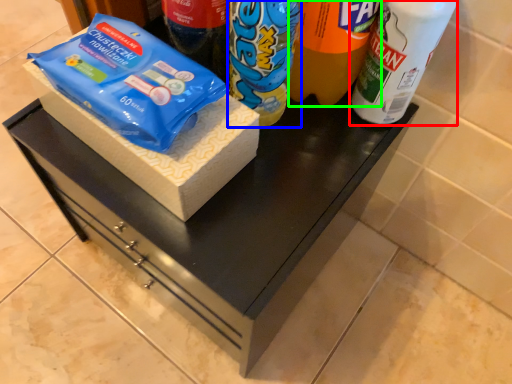
Question: Which object is positioned closest to bottle (highlighted by a red box)? Select from yoghurt (highlighted by a blue box) and drinking straw (highlighted by a green box).

Choices:
 (A) yoghurt
 (B) drinking straw

Answer: (B)